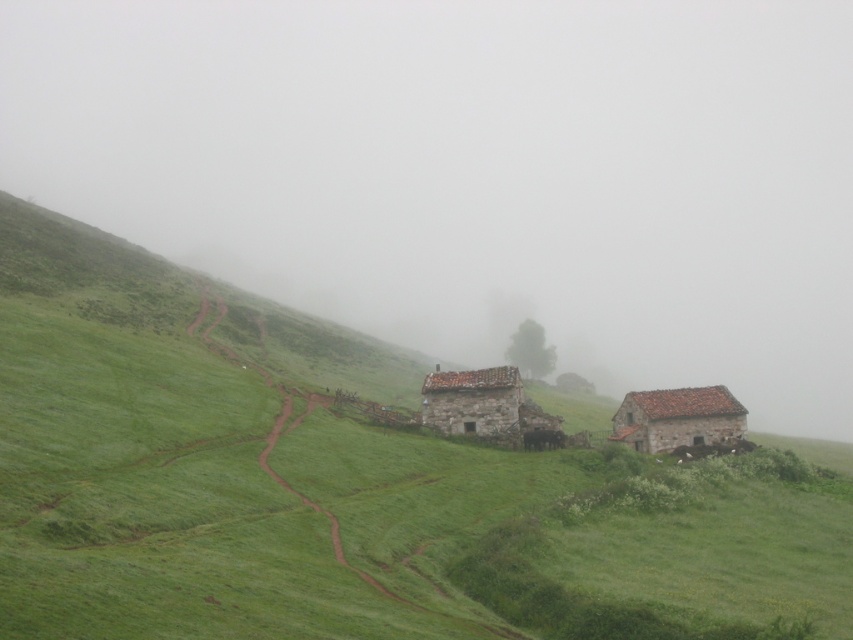
Which of these two, green grassy at lower left or brown stone hut at lower right, stands shorter?

Standing shorter between the two is brown stone hut at lower right.

From the picture: Does green grassy at lower left have a smaller size compared to brown stone hut at lower right?

No, green grassy at lower left is not smaller than brown stone hut at lower right.

Measure the distance between green grassy at lower left and camera.

green grassy at lower left is 58.96 feet from camera.

Identify the location of green grassy at lower left. The height and width of the screenshot is (640, 853). (350, 484).

You are a GUI agent. You are given a task and a screenshot of the screen. Output one action in this format:
    pyautogui.click(x=<x>, y=<y>)
    Task: Click on the green grassy at lower left
    The height and width of the screenshot is (640, 853).
    Given the screenshot: What is the action you would take?
    pyautogui.click(x=350, y=484)

Is green grassy at lower left to the right of rustic stone hut at center from the viewer's perspective?

In fact, green grassy at lower left is to the left of rustic stone hut at center.

This screenshot has height=640, width=853. What do you see at coordinates (350, 484) in the screenshot?
I see `green grassy at lower left` at bounding box center [350, 484].

Locate an element on the screen. The width and height of the screenshot is (853, 640). green grassy at lower left is located at coordinates (350, 484).

Does point (628, 408) lie behind point (473, 380)?

Yes, point (628, 408) is behind point (473, 380).

Between point (722, 440) and point (474, 412), which one is positioned in front?

Point (474, 412)

I want to click on brown stone hut at lower right, so click(x=677, y=419).